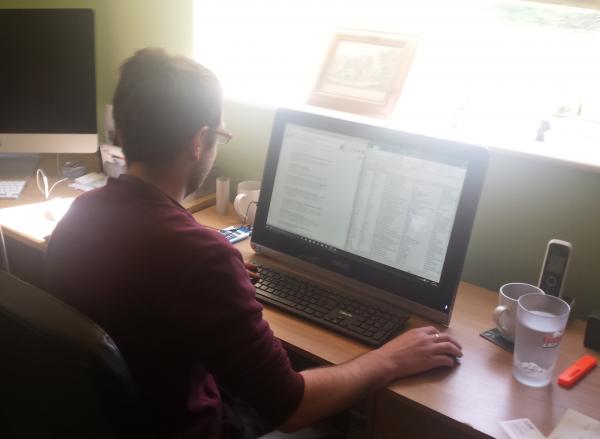
Where is `black computer keyboard`? The height and width of the screenshot is (439, 600). black computer keyboard is located at coordinates (302, 296).